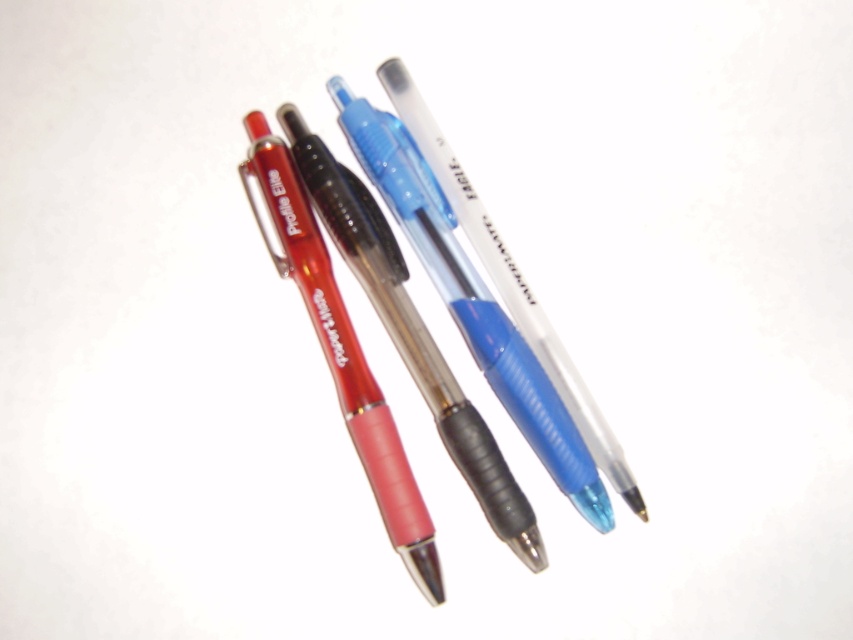
Question: Is translucent plastic pen at center above translucent plastic pen at upper left?

Choices:
 (A) no
 (B) yes

Answer: (B)

Question: Which point appears closest to the camera in this image?

Choices:
 (A) (345, 358)
 (B) (560, 445)

Answer: (B)

Question: Can you confirm if translucent plastic pen at center is positioned above translucent plastic pen at upper left?

Choices:
 (A) no
 (B) yes

Answer: (B)

Question: Where is translucent plastic pen at center located in relation to translucent plastic pen at upper left in the image?

Choices:
 (A) below
 (B) above

Answer: (B)

Question: Which point is farther to the camera?

Choices:
 (A) translucent plastic pen at upper left
 (B) translucent plastic pen at center

Answer: (B)